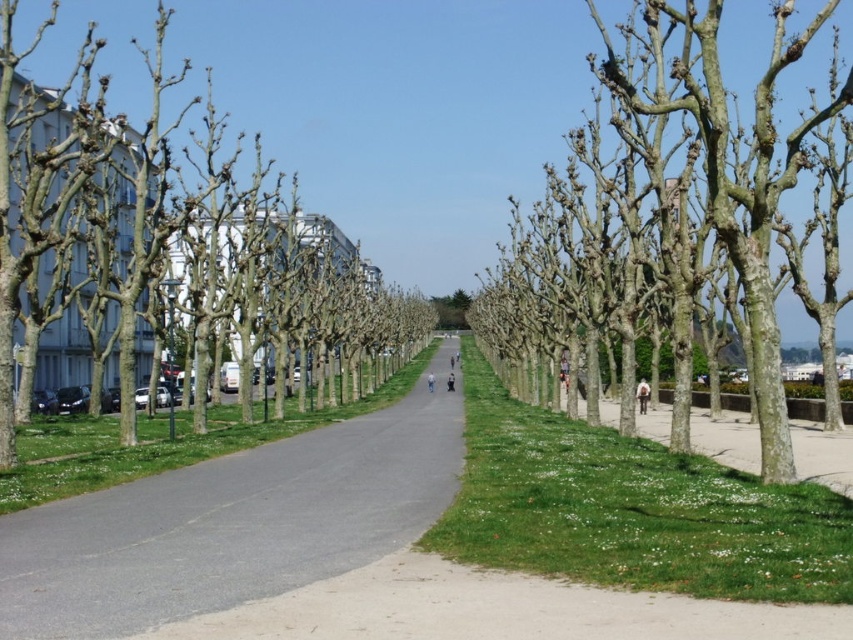
You are driving a car that is 2 meters wide. You need to park your car along the gray asphalt road at center and the smooth bark tree at left. Which location allows your car to fit without overlapping any objects?

The gray asphalt road at center occupies less space than the smooth bark tree at left, so the car can fit on the smooth bark tree at left since it has more space available.

You are standing on the pathway and want to cross to the other side. The gray asphalt road at center and the bark textured trees at center are in your way. Which one should you move around to reach the other side?

You should move around the gray asphalt road at center because it is in front of the bark textured trees at center, making it the closer obstacle to navigate around first.